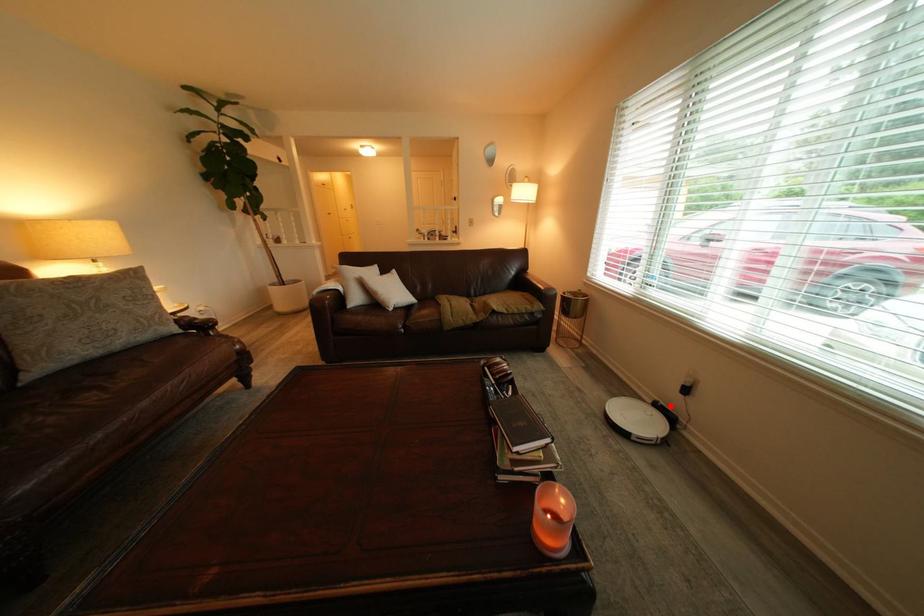
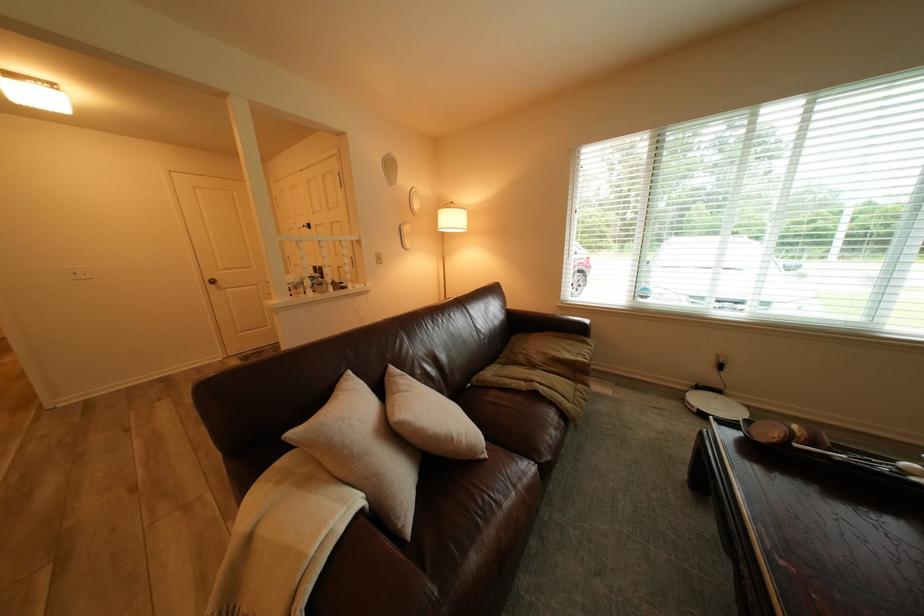
Question: A red point is marked in image1. In image2, is the corresponding 3D point closer to the camera or farther? Reply with the corresponding letter.

Choices:
 (A) The corresponding 3D point is closer.
 (B) The corresponding 3D point is farther.

Answer: (B)